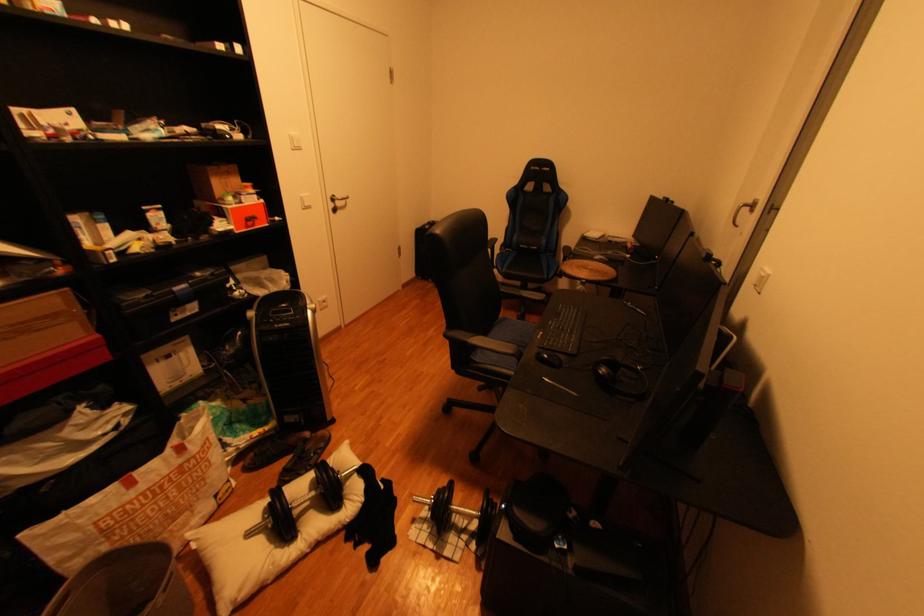
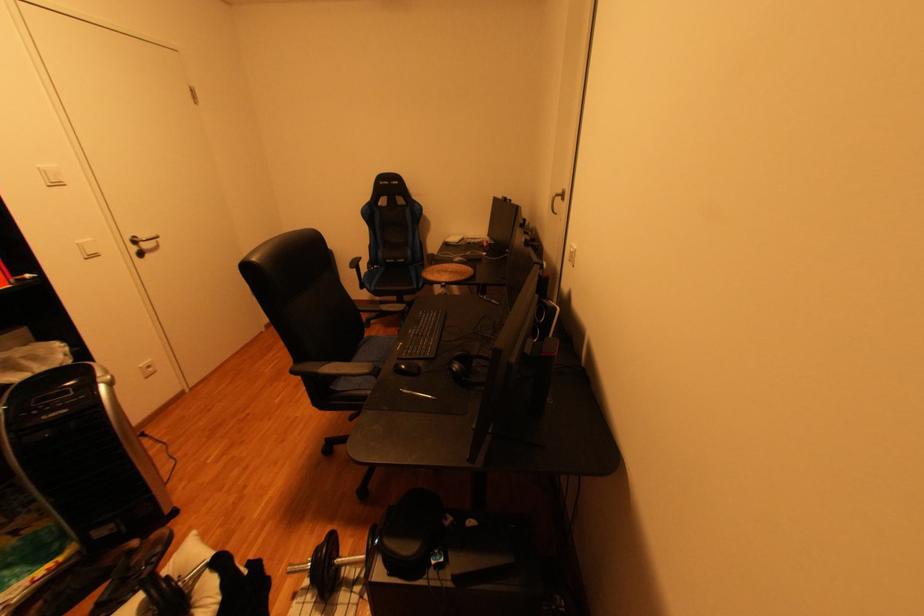
The point at (611, 373) is marked in the first image. Where is the corresponding point in the second image?

(464, 370)